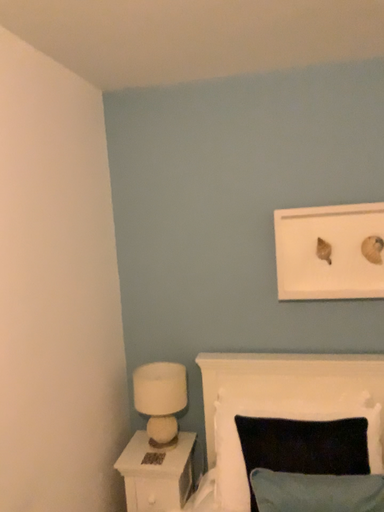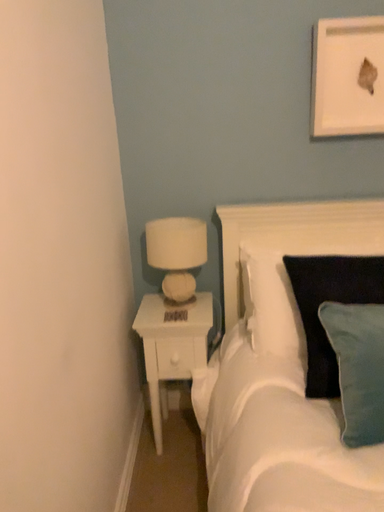
Question: How did the camera likely rotate when shooting the video?

Choices:
 (A) rotated upward
 (B) rotated downward

Answer: (B)